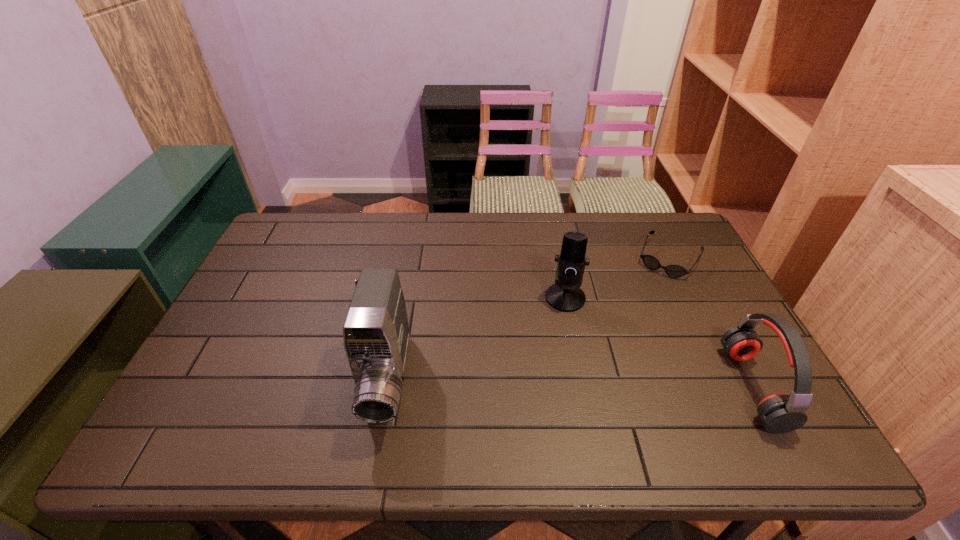
Where is `camcorder`? The image size is (960, 540). camcorder is located at coordinates (376, 333).

Locate an element on the screen. The image size is (960, 540). earphone is located at coordinates (780, 413).

This screenshot has height=540, width=960. Find the location of `the farthest object`. the farthest object is located at coordinates (651, 262).

Identify the location of the shortest object. This screenshot has height=540, width=960. (651, 262).

Locate an element on the screen. The image size is (960, 540). microphone is located at coordinates (565, 295).

Find the location of a particular element. The width and height of the screenshot is (960, 540). the second farthest object is located at coordinates (565, 295).

Identify the location of vacant space positioned 0.360m on the ear cups of the earphone. The image size is (960, 540). tap(587, 387).

Identify the location of free spot located on the ear cups of the earphone. (623, 387).

At what (x,y) coordinates should I click in order to perform the action: click on free space located 0.280m on the ear cups of the earphone. Please return your answer as a coordinate pair (x, y). This screenshot has width=960, height=540. Looking at the image, I should click on (619, 387).

This screenshot has width=960, height=540. In order to click on vacant region located on the lenses of the shortest object in this screenshot , I will do `click(647, 300)`.